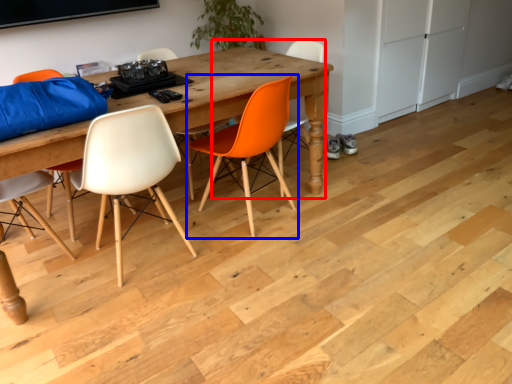
Question: Which point is closer to the camera, chair (highlighted by a red box) or chair (highlighted by a blue box)?

Choices:
 (A) chair
 (B) chair

Answer: (B)